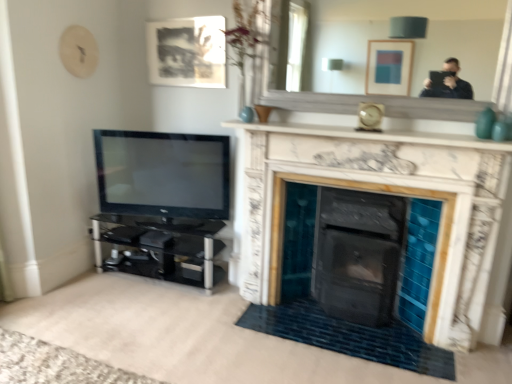
Question: From a real-world perspective, is black glossy tv at left physically below matte black picture frame at upper center?

Choices:
 (A) no
 (B) yes

Answer: (B)

Question: Is the position of black glossy tv at left more distant than that of matte black picture frame at upper center?

Choices:
 (A) no
 (B) yes

Answer: (A)

Question: Is there a large distance between black glossy tv at left and matte black picture frame at upper center?

Choices:
 (A) no
 (B) yes

Answer: (A)

Question: Considering the relative positions of black glossy tv at left and matte black picture frame at upper center in the image provided, is black glossy tv at left in front of matte black picture frame at upper center?

Choices:
 (A) no
 (B) yes

Answer: (B)

Question: Is black glossy tv at left looking in the opposite direction of matte black picture frame at upper center?

Choices:
 (A) yes
 (B) no

Answer: (B)

Question: Is black glossy tv at left at the right side of matte black picture frame at upper center?

Choices:
 (A) yes
 (B) no

Answer: (B)

Question: Would you say white marble fireplace at center is a long distance from matte black picture frame at upper center?

Choices:
 (A) yes
 (B) no

Answer: (A)

Question: Considering the relative positions of white marble fireplace at center and matte black picture frame at upper center in the image provided, is white marble fireplace at center to the left of matte black picture frame at upper center from the viewer's perspective?

Choices:
 (A) yes
 (B) no

Answer: (B)

Question: Would you say white marble fireplace at center contains matte black picture frame at upper center?

Choices:
 (A) no
 (B) yes

Answer: (A)

Question: From the image's perspective, does white marble fireplace at center appear higher than matte black picture frame at upper center?

Choices:
 (A) yes
 (B) no

Answer: (B)

Question: Is white marble fireplace at center closer to camera compared to matte black picture frame at upper center?

Choices:
 (A) yes
 (B) no

Answer: (A)

Question: From a real-world perspective, is white marble fireplace at center on top of matte black picture frame at upper center?

Choices:
 (A) no
 (B) yes

Answer: (A)

Question: From the image's perspective, is white marble fireplace at upper center on matte black picture frame at upper center?

Choices:
 (A) yes
 (B) no

Answer: (B)